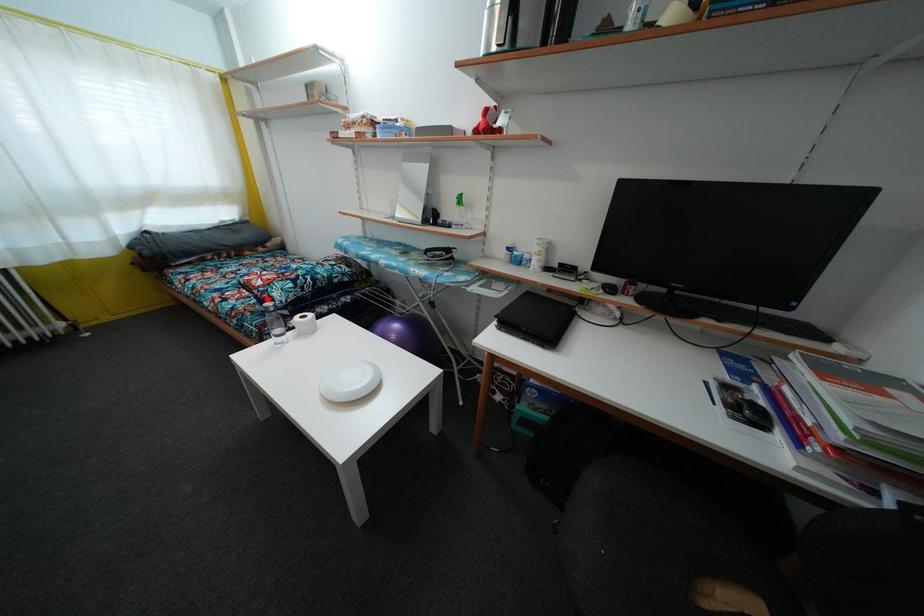
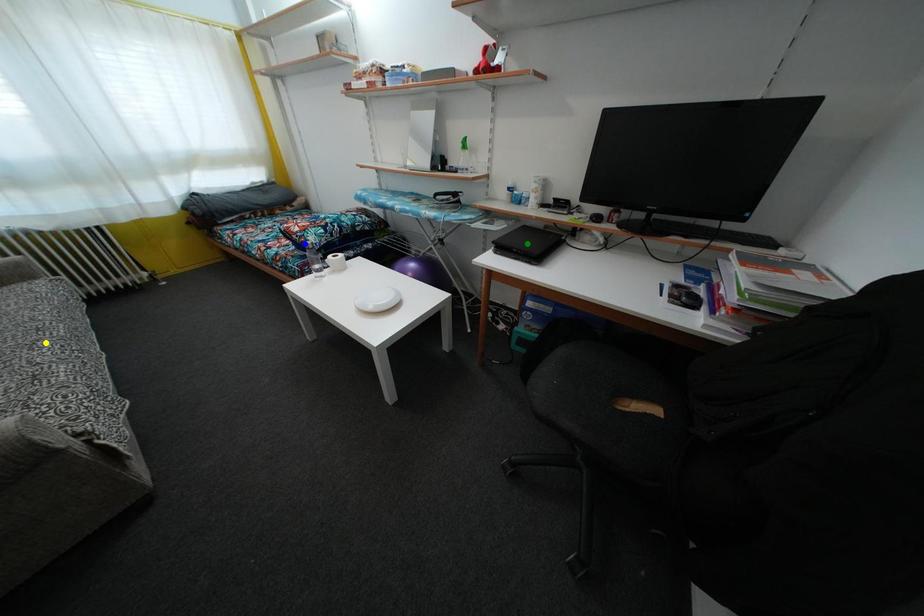
Question: I am providing you with two images of the same scene from different viewpoints. A red point is marked on the first image. You are given multiple points on the second image. Which spot in image 2 lines up with the point in image 1?

Choices:
 (A) blue point
 (B) yellow point
 (C) green point

Answer: (A)